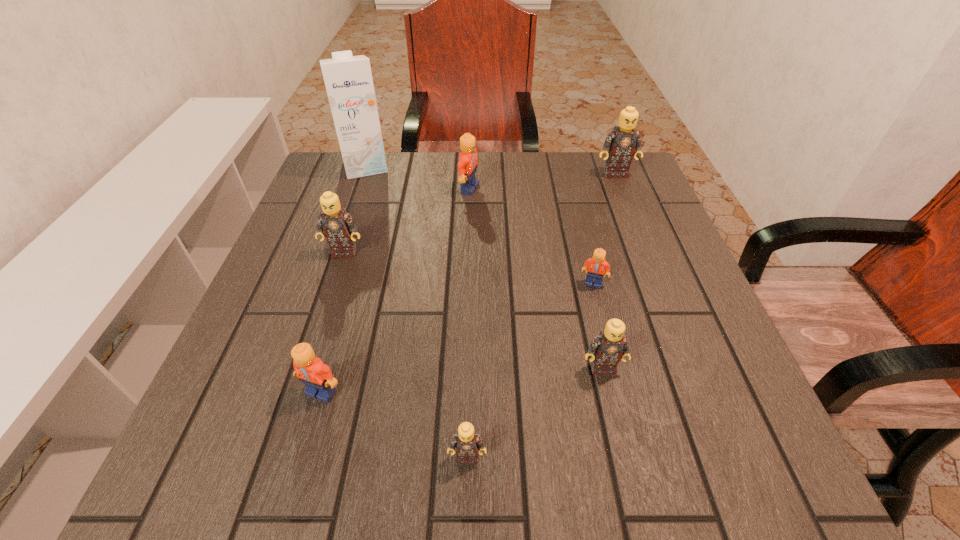
The image size is (960, 540). What are the coordinates of `free location at the right edge of the desktop` in the screenshot? It's located at pos(705,373).

Image resolution: width=960 pixels, height=540 pixels. Identify the location of free spot at the near left corner of the desktop. (292, 451).

Identify the location of vacant space at the far right corner of the desktop. (639, 181).

Find the location of a particular element. This screenshot has height=540, width=960. free space at the near right corner of the desktop is located at coordinates (708, 494).

Where is `vacant space in between the fourth nearest object and the second nearest Lego`? This screenshot has width=960, height=540. vacant space in between the fourth nearest object and the second nearest Lego is located at coordinates (457, 338).

Locate an element on the screen. unoccupied position between the rightmost object and the tallest object is located at coordinates (491, 170).

Where is `vacant area that lies between the second farthest orange Lego and the carton`? Image resolution: width=960 pixels, height=540 pixels. vacant area that lies between the second farthest orange Lego and the carton is located at coordinates (479, 225).

In order to click on vacant area between the carton and the rightmost object in this screenshot , I will do `click(491, 170)`.

Locate an element on the screen. The image size is (960, 540). free space between the second nearest object and the farthest Lego is located at coordinates (468, 283).

This screenshot has height=540, width=960. In order to click on free space between the second biggest tan Lego and the second farthest orange Lego in this screenshot , I will do `click(468, 268)`.